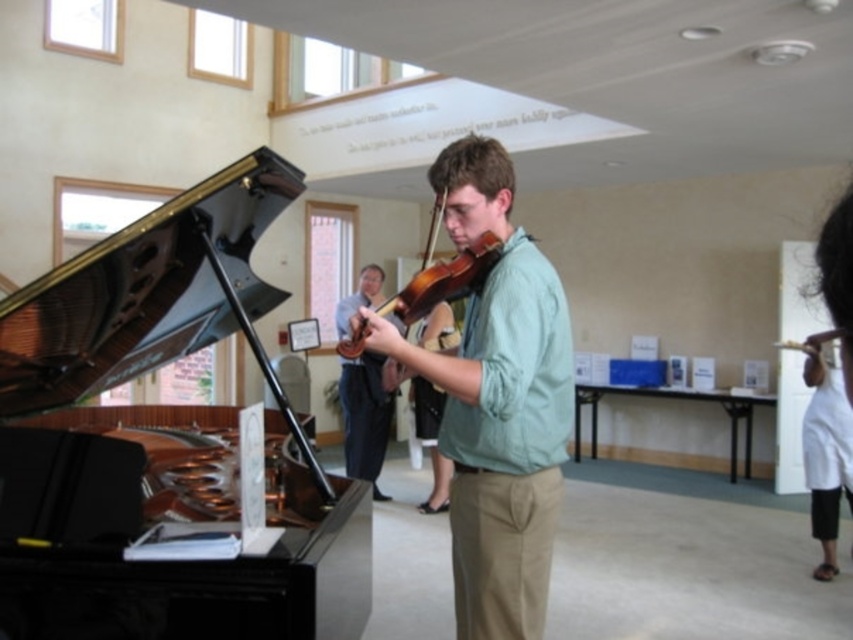
Is khaki cotton pants at center taller than matte green shirt at center?

No, khaki cotton pants at center is not taller than matte green shirt at center.

I want to click on khaki cotton pants at center, so click(x=497, y=403).

Does khaki cotton pants at center come behind wooden violin at center?

No, khaki cotton pants at center is closer to the viewer.

What do you see at coordinates (497, 403) in the screenshot?
I see `khaki cotton pants at center` at bounding box center [497, 403].

Locate an element on the screen. khaki cotton pants at center is located at coordinates (497, 403).

Can you confirm if black polished piano at left is positioned to the left of matte green shirt at center?

Indeed, black polished piano at left is positioned on the left side of matte green shirt at center.

Can you confirm if black polished piano at left is thinner than matte green shirt at center?

In fact, black polished piano at left might be wider than matte green shirt at center.

Does point (292, 582) come in front of point (370, 362)?

That is True.

At what (x,y) coordinates should I click in order to perform the action: click on black polished piano at left. Please return your answer as a coordinate pair (x, y). This screenshot has width=853, height=640. Looking at the image, I should click on (146, 291).